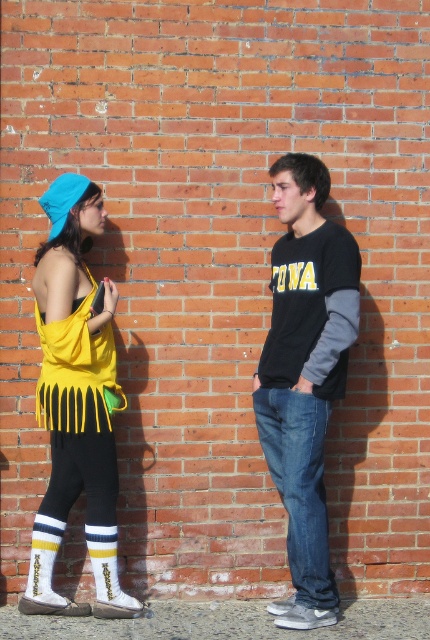
Which is above, yellow fringe dress at left or denim jeans at center?

Positioned higher is yellow fringe dress at left.

Is point (101, 211) behind point (257, 419)?

No, it is not.

Is point (63, 413) positioned after point (334, 586)?

No, (63, 413) is in front of (334, 586).

Find the location of `yellow fringe dress at left`. yellow fringe dress at left is located at coordinates (76, 403).

Between black cotton shirt at center and yellow fringe dress at left, which one has less height?

With less height is yellow fringe dress at left.

Can you confirm if black cotton shirt at center is thinner than yellow fringe dress at left?

Yes.

Between point (289, 372) and point (79, 413), which one is positioned in front?

Point (79, 413)

You are a GUI agent. You are given a task and a screenshot of the screen. Output one action in this format:
    pyautogui.click(x=<x>, y=<y>)
    Task: Click on the black cotton shirt at center
    This screenshot has height=640, width=430.
    Given the screenshot: What is the action you would take?
    pyautogui.click(x=304, y=374)

Is denim jeans at center wider than striped wool sock at lower left?

Yes, denim jeans at center is wider than striped wool sock at lower left.

Does denim jeans at center have a lesser width compared to striped wool sock at lower left?

No.

Which is in front, point (326, 582) or point (101, 577)?

Point (101, 577) is more forward.

Image resolution: width=430 pixels, height=640 pixels. I want to click on denim jeans at center, so click(300, 484).